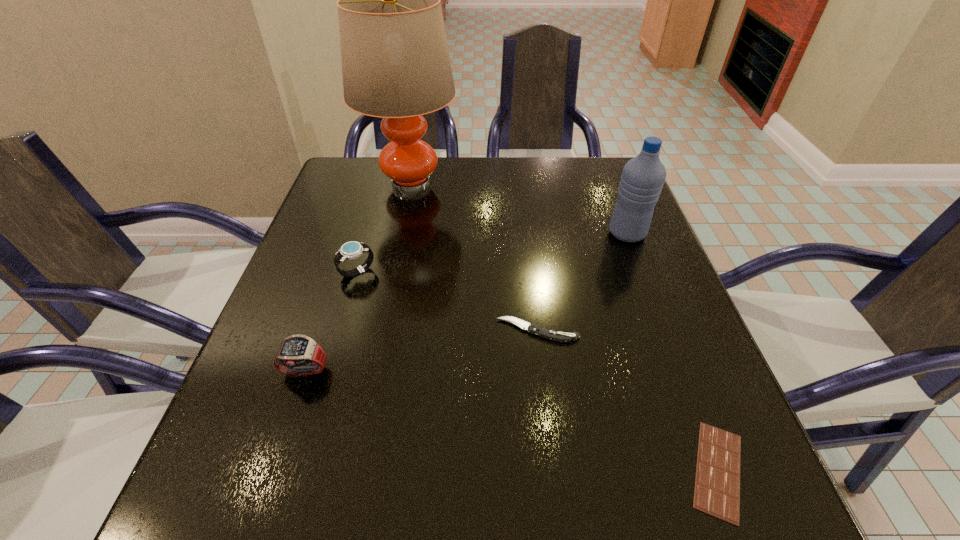
Where is `free space located on the front of the tallest object`? The height and width of the screenshot is (540, 960). free space located on the front of the tallest object is located at coordinates (384, 319).

This screenshot has width=960, height=540. What are the coordinates of `free space located on the left of the water bottle` in the screenshot? It's located at (532, 233).

The height and width of the screenshot is (540, 960). In order to click on free space located on the back of the fourth nearest object in this screenshot , I will do `click(374, 213)`.

You are a GUI agent. You are given a task and a screenshot of the screen. Output one action in this format:
    pyautogui.click(x=<x>, y=<y>)
    Task: Click on the free space located 0.170m on the front of the fifth farthest object
    The width and height of the screenshot is (960, 540).
    Given the screenshot: What is the action you would take?
    pyautogui.click(x=264, y=492)

Image resolution: width=960 pixels, height=540 pixels. In order to click on vacant area located 0.140m on the right of the pocketknife in this screenshot , I will do `click(653, 330)`.

Identify the location of free region located 0.290m on the left of the nearest object. This screenshot has height=540, width=960. (480, 470).

The image size is (960, 540). I want to click on object that is at the far edge, so 395,60.

Where is `object present at the near edge`? Image resolution: width=960 pixels, height=540 pixels. object present at the near edge is located at coordinates (717, 481).

Locate an element on the screen. The width and height of the screenshot is (960, 540). lamp that is at the left edge is located at coordinates (395, 60).

What are the coordinates of `water bottle at the right edge` in the screenshot? It's located at (642, 179).